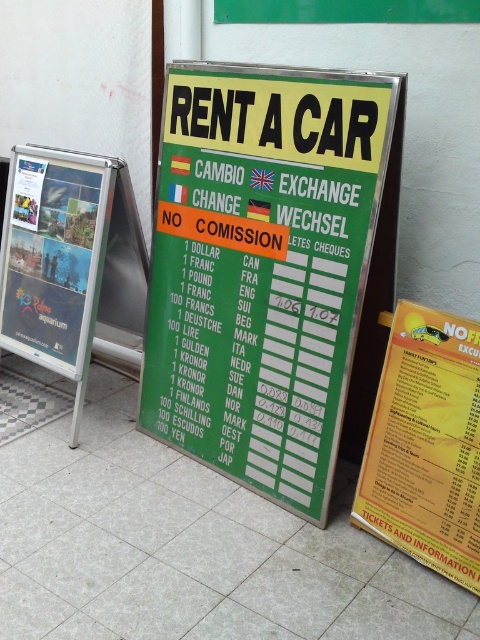
You are a tourist who wants to check both the car rental rates and the currency exchange rates. You see the green plastic sign at center and the yellow paper menu at center. Which object should you look at first to find the currency exchange rates?

The green plastic sign at center lists currency exchange rates for various international currencies, so you should look at the green plastic sign at center first to find the currency exchange rates.

You are standing at the origin point of the coordinate system. You want to reach the yellow paper menu at center. Which direction should you move in the x and y axes?

The yellow paper menu at center is located at coordinate point 0.695 in the x axis and 0.887 in the y axis. So you should move in the positive direction along both the x and y axes to reach it.